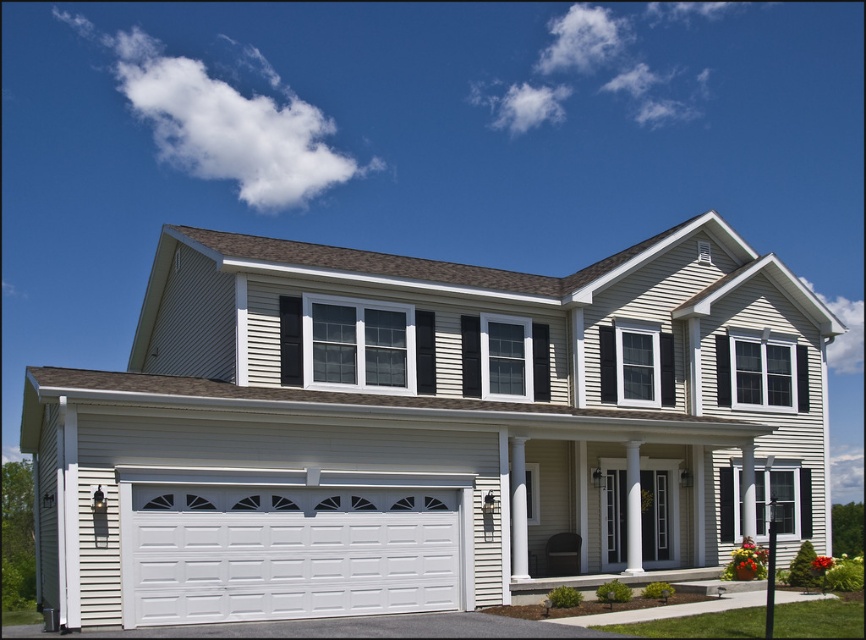
Question: Does white painted wood garage door at lower center lie in front of gray asphalt driveway at lower center?

Choices:
 (A) no
 (B) yes

Answer: (A)

Question: Which object is the farthest from the white painted wood garage door at lower left?

Choices:
 (A) white painted wood garage door at lower center
 (B) gray asphalt driveway at lower center

Answer: (A)

Question: Can you confirm if white painted wood garage door at lower left is wider than white painted wood garage door at lower center?

Choices:
 (A) yes
 (B) no

Answer: (A)

Question: Which point appears farthest from the camera in this image?

Choices:
 (A) (137, 484)
 (B) (107, 634)

Answer: (A)

Question: Considering the real-world distances, which object is closest to the gray asphalt driveway at lower center?

Choices:
 (A) white painted wood garage door at lower left
 (B) white painted wood garage door at lower center

Answer: (B)

Question: Does white painted wood garage door at lower left have a larger size compared to white painted wood garage door at lower center?

Choices:
 (A) yes
 (B) no

Answer: (A)